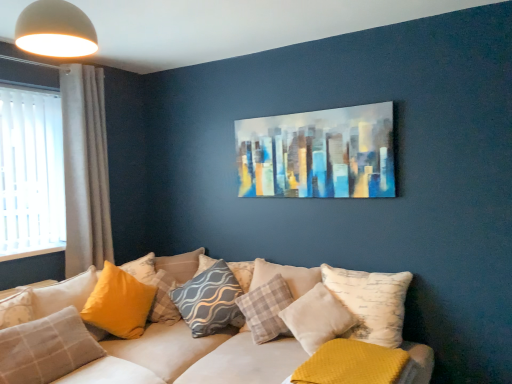
Question: Is gray textured pillow at center, the sixth pillow in the left-to-right sequence, outside mustard yellow textured pillow at lower right, which is the 9th pillow from left to right?

Choices:
 (A) no
 (B) yes

Answer: (B)

Question: Considering the relative sizes of gray textured pillow at center, the sixth pillow in the left-to-right sequence, and mustard yellow textured pillow at lower right, which ranks as the 1th pillow in right-to-left order, in the image provided, is gray textured pillow at center, the sixth pillow in the left-to-right sequence, smaller than mustard yellow textured pillow at lower right, which ranks as the 1th pillow in right-to-left order,?

Choices:
 (A) no
 (B) yes

Answer: (A)

Question: Could you tell me if gray textured pillow at center, the 4th pillow from the right, is turned towards mustard yellow textured pillow at lower right, which ranks as the 1th pillow in right-to-left order?

Choices:
 (A) yes
 (B) no

Answer: (B)

Question: Is gray textured pillow at center, the sixth pillow in the left-to-right sequence, to the right of mustard yellow textured pillow at lower right, which is the 9th pillow from left to right, from the viewer's perspective?

Choices:
 (A) no
 (B) yes

Answer: (A)

Question: Can you confirm if gray textured pillow at center, the sixth pillow in the left-to-right sequence, is bigger than mustard yellow textured pillow at lower right, which ranks as the 1th pillow in right-to-left order?

Choices:
 (A) no
 (B) yes

Answer: (B)

Question: Considering the positions of yellow fabric pillow at lower left, the second pillow positioned from the left, and abstract painting at upper center in the image, is yellow fabric pillow at lower left, the second pillow positioned from the left, bigger or smaller than abstract painting at upper center?

Choices:
 (A) small
 (B) big

Answer: (B)

Question: Is point (27, 340) closer or farther from the camera than point (368, 155)?

Choices:
 (A) farther
 (B) closer

Answer: (B)

Question: Looking at their shapes, would you say yellow fabric pillow at lower left, which is the 8th pillow in right-to-left order, is wider or thinner than abstract painting at upper center?

Choices:
 (A) wide
 (B) thin

Answer: (A)

Question: Visually, is yellow fabric pillow at lower left, the second pillow positioned from the left, positioned to the left or to the right of abstract painting at upper center?

Choices:
 (A) left
 (B) right

Answer: (A)

Question: From the image's perspective, is mustard yellow textured pillow at lower right, which is the 9th pillow from left to right, above or below gray textured pillow at center, the 4th pillow from the right?

Choices:
 (A) below
 (B) above

Answer: (A)

Question: Is point (372, 367) positioned closer to the camera than point (209, 264)?

Choices:
 (A) farther
 (B) closer

Answer: (B)

Question: From a real-world perspective, is mustard yellow textured pillow at lower right, which is the 9th pillow from left to right, physically located above or below gray textured pillow at center, the sixth pillow in the left-to-right sequence?

Choices:
 (A) above
 (B) below

Answer: (B)

Question: Considering the positions of mustard yellow textured pillow at lower right, which is the 9th pillow from left to right, and gray textured pillow at center, the sixth pillow in the left-to-right sequence, in the image, is mustard yellow textured pillow at lower right, which is the 9th pillow from left to right, taller or shorter than gray textured pillow at center, the sixth pillow in the left-to-right sequence,?

Choices:
 (A) short
 (B) tall

Answer: (A)

Question: From a real-world perspective, is gray textured pillow at center, the 4th pillow from the right, above or below white textured pillow at center, the 2th pillow positioned from the right?

Choices:
 (A) below
 (B) above

Answer: (B)

Question: Considering their positions, is gray textured pillow at center, the sixth pillow in the left-to-right sequence, located in front of or behind white textured pillow at center, the 2th pillow positioned from the right?

Choices:
 (A) behind
 (B) front

Answer: (A)